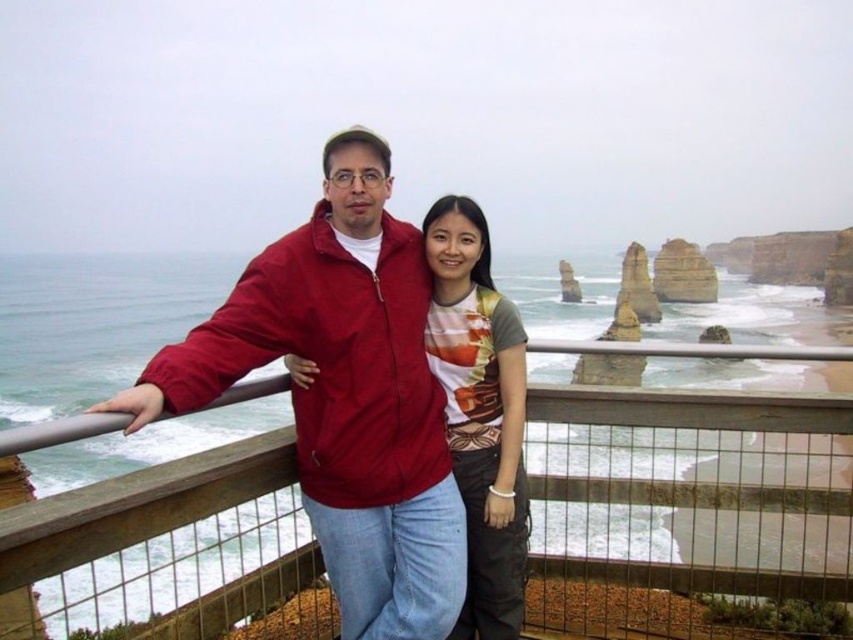
Who is taller, wooden at center or printed cotton t-shirt at center?

With more height is wooden at center.

Does wooden at center appear on the right side of printed cotton t-shirt at center?

Indeed, wooden at center is positioned on the right side of printed cotton t-shirt at center.

Who is more distant from viewer, (x=784, y=429) or (x=480, y=529)?

The point (x=480, y=529) is more distant.

Image resolution: width=853 pixels, height=640 pixels. I want to click on wooden at center, so (x=689, y=513).

Between matte red jacket at center and printed cotton t-shirt at center, which one has more height?

With more height is matte red jacket at center.

Can you confirm if matte red jacket at center is taller than printed cotton t-shirt at center?

Yes, matte red jacket at center is taller than printed cotton t-shirt at center.

Does point (332, 202) lie behind point (509, 588)?

Yes, point (332, 202) is behind point (509, 588).

The height and width of the screenshot is (640, 853). I want to click on matte red jacket at center, so click(344, 396).

Is matte red jacket at center to the left of matte gray t-shirt at center from the viewer's perspective?

Indeed, matte red jacket at center is positioned on the left side of matte gray t-shirt at center.

Where is `matte red jacket at center`? The height and width of the screenshot is (640, 853). matte red jacket at center is located at coordinates (344, 396).

Between point (375, 144) and point (508, 368), which one is positioned in front?

Point (508, 368) is in front.

Where is `matte red jacket at center`? matte red jacket at center is located at coordinates (344, 396).